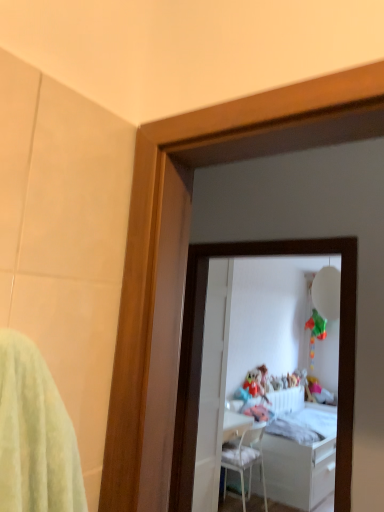
Question: Does point (233, 456) appear closer or farther from the camera than point (294, 443)?

Choices:
 (A) farther
 (B) closer

Answer: (B)

Question: From the image's perspective, is white plastic chair at center above or below white glossy bed at center?

Choices:
 (A) above
 (B) below

Answer: (A)

Question: Based on their relative distances, which object is farther from the white glossy bed at center?

Choices:
 (A) white glossy mirror at center
 (B) white glossy door at center
 (C) white plastic chair at center

Answer: (B)

Question: Which is farther from the white plastic chair at center?

Choices:
 (A) white glossy bed at center
 (B) white glossy mirror at center
 (C) white glossy door at center

Answer: (C)